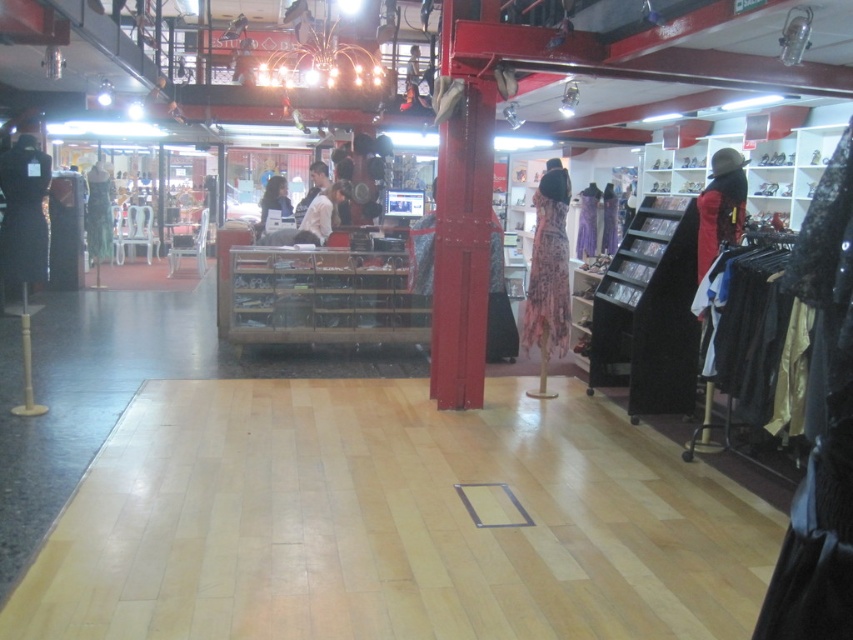
Question: Estimate the real-world distances between objects in this image. Which object is farther from the green sequined dress at center?

Choices:
 (A) black fabric dress at right
 (B) floral fabric dress at center

Answer: (A)

Question: Where is floral-patterned fabric dress at center located in relation to green sequined dress at center in the image?

Choices:
 (A) left
 (B) right

Answer: (B)

Question: Is black lace dress at right positioned in front of matte black dress at center?

Choices:
 (A) no
 (B) yes

Answer: (B)

Question: In this image, where is black matte coat at left located relative to purple satin dress at center?

Choices:
 (A) above
 (B) below

Answer: (B)

Question: Which object is farther from the camera taking this photo?

Choices:
 (A) purple satin dress at center
 (B) white matte shirt at center
 (C) green sequined dress at center

Answer: (A)

Question: Considering the real-world distances, which object is closest to the purple satin dress at center?

Choices:
 (A) floral fabric dress at center
 (B) black lace dress at right

Answer: (A)